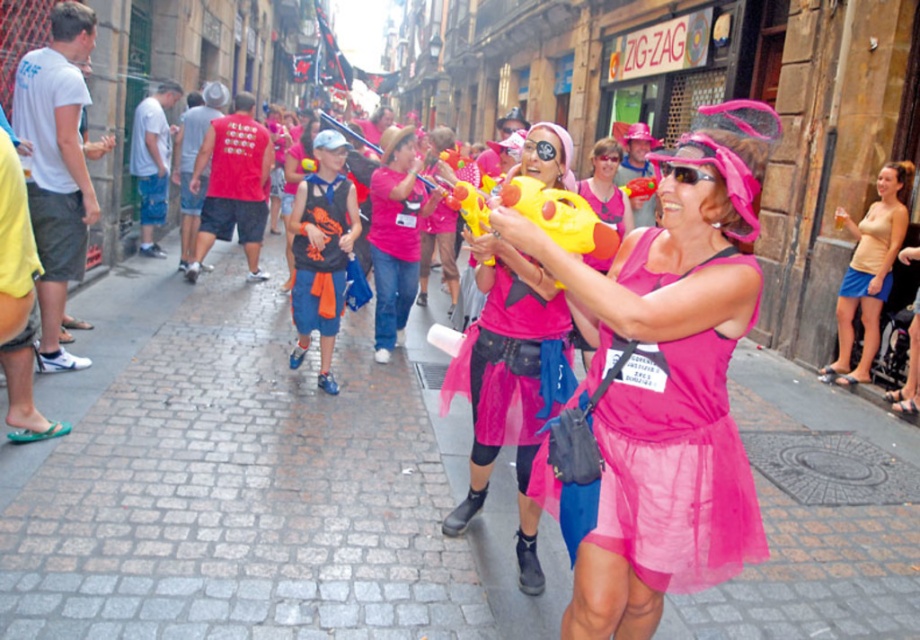
You are a photographer trying to capture a clear shot of both the pink fabric toy gun at center and the beige cotton tank top at right. Based on their positions, which object will appear closer to the camera in the photo?

The pink fabric toy gun at center will appear closer to the camera because it is positioned in front of the beige cotton tank top at right.